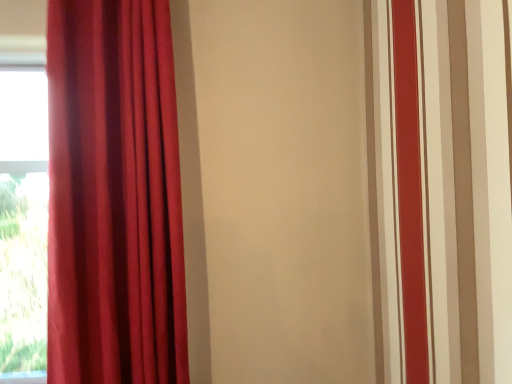
Locate an element on the screen. matte red curtain at left is located at coordinates (114, 196).

Image resolution: width=512 pixels, height=384 pixels. Describe the element at coordinates (114, 196) in the screenshot. I see `matte red curtain at left` at that location.

Where is `matte red curtain at left`? Image resolution: width=512 pixels, height=384 pixels. matte red curtain at left is located at coordinates (114, 196).